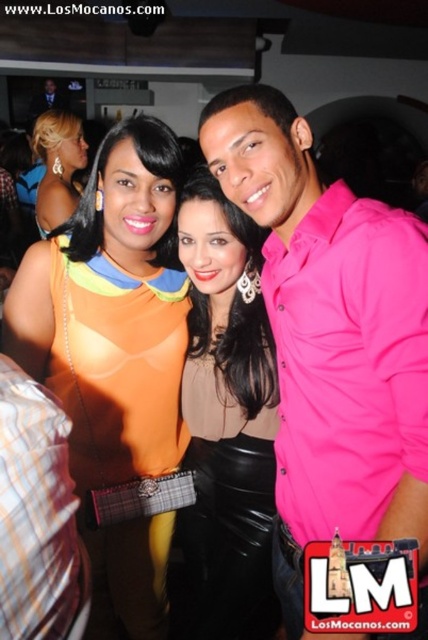
Question: Which point is closer to the camera?

Choices:
 (A) pink satin shirt at right
 (B) matte black skirt at center

Answer: (A)

Question: Does orange fabric dress at center have a larger size compared to plaid fabric shirt at left?

Choices:
 (A) yes
 (B) no

Answer: (A)

Question: Can you confirm if pink matte shirt at center is thinner than plaid fabric shirt at left?

Choices:
 (A) yes
 (B) no

Answer: (B)

Question: Which point is closer to the camera taking this photo?

Choices:
 (A) (33, 596)
 (B) (85, 164)
 (C) (234, 339)

Answer: (A)

Question: Is pink matte shirt at center thinner than pink satin shirt at right?

Choices:
 (A) yes
 (B) no

Answer: (B)

Question: Among these points, which one is nearest to the camera?

Choices:
 (A) (189, 408)
 (B) (71, 547)
 (C) (65, 141)

Answer: (B)